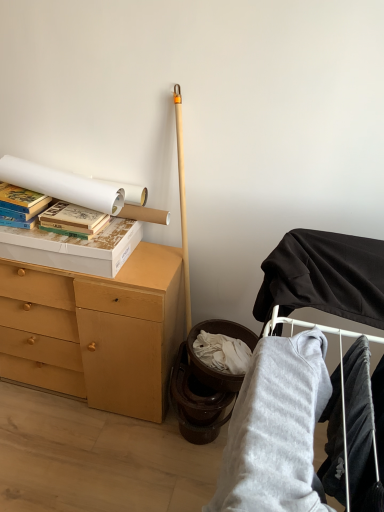
What do you see at coordinates (71, 219) in the screenshot? I see `matte cardboard book at upper left, which is the first paperback book from right to left` at bounding box center [71, 219].

This screenshot has height=512, width=384. What do you see at coordinates (276, 429) in the screenshot?
I see `gray fleece sweatshirt at lower right, the 1th clothing positioned from the left` at bounding box center [276, 429].

You are a GUI agent. You are given a task and a screenshot of the screen. Output one action in this format:
    pyautogui.click(x=<x>, y=<y>)
    Task: Click on the white cardboard box at upper left
    The height and width of the screenshot is (512, 384).
    Given the screenshot: What is the action you would take?
    pyautogui.click(x=74, y=248)

The image size is (384, 512). I want to click on black matte fabric at upper right, so click(x=344, y=421).

This screenshot has height=512, width=384. Identify the location of velvet black pants at lower right, the 2th clothing from the left. (363, 430).

This screenshot has height=512, width=384. In order to click on hardcover books at left, marked as the first paperback book in a left-to-right arrangement in this screenshot , I will do `click(22, 200)`.

Which of these two, black matte fabric at upper right or light brown wood chest of drawers at left, is bigger?

light brown wood chest of drawers at left is bigger.

Looking at this image, which of these two, black matte fabric at upper right or light brown wood chest of drawers at left, is thinner?

With smaller width is light brown wood chest of drawers at left.

Considering the points (342, 379) and (96, 377), which point is behind, point (342, 379) or point (96, 377)?

The point (96, 377) is farther.

Considering the relative sizes of light brown wood chest of drawers at left and white cardboard box at upper left in the image provided, is light brown wood chest of drawers at left wider than white cardboard box at upper left?

Yes.

Is white cardboard box at upper left at the back of light brown wood chest of drawers at left?

No, white cardboard box at upper left is not at the back of light brown wood chest of drawers at left.

From the image's perspective, which one is positioned higher, light brown wood chest of drawers at left or white cardboard box at upper left?

white cardboard box at upper left is shown above in the image.

This screenshot has width=384, height=512. I want to click on the chest of drawers lying below the black matte fabric at upper right (from the image's perspective), so point(96,330).

From the image's perspective, who appears lower, light brown wood chest of drawers at left or black matte fabric at upper right?

light brown wood chest of drawers at left appears lower in the image.

Is light brown wood chest of drawers at left facing away from black matte fabric at upper right?

No, light brown wood chest of drawers at left is not facing away from black matte fabric at upper right.

From the image's perspective, is matte cardboard book at upper left, which is the first paperback book from right to left, positioned above or below gray fleece sweatshirt at lower right, the 1th clothing positioned from the left?

Clearly, from the image's perspective, matte cardboard book at upper left, which is the first paperback book from right to left, is above gray fleece sweatshirt at lower right, the 1th clothing positioned from the left.

Is matte cardboard book at upper left, which is the first paperback book from right to left, not near gray fleece sweatshirt at lower right, positioned as the 2th clothing in right-to-left order?

No, matte cardboard book at upper left, which is the first paperback book from right to left, is in close proximity to gray fleece sweatshirt at lower right, positioned as the 2th clothing in right-to-left order.

From a real-world perspective, which object rests below the other?

gray fleece sweatshirt at lower right, the 1th clothing positioned from the left, from a real-world perspective.

Is gray fleece sweatshirt at lower right, positioned as the 2th clothing in right-to-left order, at the right side of black matte fabric at upper right?

No.

How different are the orientations of gray fleece sweatshirt at lower right, positioned as the 2th clothing in right-to-left order, and black matte fabric at upper right in degrees?

gray fleece sweatshirt at lower right, positioned as the 2th clothing in right-to-left order, and black matte fabric at upper right are facing 0.000905 degrees away from each other.

I want to click on clothing that is under the black matte fabric at upper right (from a real-world perspective), so click(276, 429).

Would you say gray fleece sweatshirt at lower right, the 1th clothing positioned from the left, is inside or outside black matte fabric at upper right?

gray fleece sweatshirt at lower right, the 1th clothing positioned from the left, is not enclosed by black matte fabric at upper right.

Between light brown wood chest of drawers at left and matte cardboard book at upper left, the 2th paperback book viewed from the left, which one appears on the right side from the viewer's perspective?

From the viewer's perspective, matte cardboard book at upper left, the 2th paperback book viewed from the left, appears more on the right side.

Does light brown wood chest of drawers at left have a greater height compared to matte cardboard book at upper left, the 2th paperback book viewed from the left?

Yes, light brown wood chest of drawers at left is taller than matte cardboard book at upper left, the 2th paperback book viewed from the left.

What's the angular difference between light brown wood chest of drawers at left and matte cardboard book at upper left, which is the first paperback book from right to left,'s facing directions?

The angular difference between light brown wood chest of drawers at left and matte cardboard book at upper left, which is the first paperback book from right to left, is 0.304 degrees.

Consider the image. Could you tell me if light brown wood chest of drawers at left is turned towards matte cardboard book at upper left, which is the first paperback book from right to left?

No.

What's the angular difference between gray fleece sweatshirt at lower right, the 1th clothing positioned from the left, and matte cardboard book at upper left, which is the first paperback book from right to left,'s facing directions?

gray fleece sweatshirt at lower right, the 1th clothing positioned from the left, and matte cardboard book at upper left, which is the first paperback book from right to left, are facing 90.9 degrees away from each other.

Considering the relative sizes of gray fleece sweatshirt at lower right, positioned as the 2th clothing in right-to-left order, and matte cardboard book at upper left, which is the first paperback book from right to left, in the image provided, is gray fleece sweatshirt at lower right, positioned as the 2th clothing in right-to-left order, taller than matte cardboard book at upper left, which is the first paperback book from right to left,?

Yes.

Considering the sizes of gray fleece sweatshirt at lower right, positioned as the 2th clothing in right-to-left order, and matte cardboard book at upper left, which is the first paperback book from right to left, in the image, is gray fleece sweatshirt at lower right, positioned as the 2th clothing in right-to-left order, wider or thinner than matte cardboard book at upper left, which is the first paperback book from right to left,?

Clearly, gray fleece sweatshirt at lower right, positioned as the 2th clothing in right-to-left order, has more width compared to matte cardboard book at upper left, which is the first paperback book from right to left.

From a real-world perspective, does gray fleece sweatshirt at lower right, the 1th clothing positioned from the left, stand above matte cardboard book at upper left, the 2th paperback book viewed from the left?

Actually, gray fleece sweatshirt at lower right, the 1th clothing positioned from the left, is physically below matte cardboard book at upper left, the 2th paperback book viewed from the left, in the real world.

I want to click on the chest of drawers that is below the black matte fabric at upper right (from the image's perspective), so click(x=96, y=330).

This screenshot has width=384, height=512. What are the coordinates of `box that is above the light brown wood chest of drawers at left (from the image's perspective)` in the screenshot? It's located at (74, 248).

From the picture: Based on their spatial positions, is light brown wood chest of drawers at left or black matte fabric at upper right closer to gray fleece sweatshirt at lower right, the 1th clothing positioned from the left?

Based on the image, black matte fabric at upper right appears to be nearer to gray fleece sweatshirt at lower right, the 1th clothing positioned from the left.

When comparing their distances from velvet black pants at lower right, the 2th clothing from the left, does white cardboard box at upper left or matte cardboard book at upper left, which is the first paperback book from right to left, seem further?

matte cardboard book at upper left, which is the first paperback book from right to left, is further to velvet black pants at lower right, the 2th clothing from the left.

Consider the image. Based on their spatial positions, is matte cardboard book at upper left, the 2th paperback book viewed from the left, or velvet black pants at lower right, the 2th clothing from the left, closer to black matte fabric at upper right?

The object closer to black matte fabric at upper right is velvet black pants at lower right, the 2th clothing from the left.

When comparing their distances from white cardboard box at upper left, does black matte fabric at upper right or matte cardboard book at upper left, which is the first paperback book from right to left, seem closer?

matte cardboard book at upper left, which is the first paperback book from right to left, lies closer to white cardboard box at upper left than the other object.

Looking at the image, which one is located further to gray fleece sweatshirt at lower right, positioned as the 2th clothing in right-to-left order, velvet black pants at lower right, the 2th clothing from the left, or hardcover books at left, which is counted as the 2th paperback book, starting from the right?

hardcover books at left, which is counted as the 2th paperback book, starting from the right, lies further to gray fleece sweatshirt at lower right, positioned as the 2th clothing in right-to-left order, than the other object.

From the image, which object appears to be nearer to matte cardboard book at upper left, which is the first paperback book from right to left, hardcover books at left, marked as the first paperback book in a left-to-right arrangement, or black matte fabric at upper right?

The object closer to matte cardboard book at upper left, which is the first paperback book from right to left, is hardcover books at left, marked as the first paperback book in a left-to-right arrangement.

From the image, which object appears to be farther from velvet black pants at lower right, the 2th clothing from the left, light brown wood chest of drawers at left or matte cardboard book at upper left, which is the first paperback book from right to left?

matte cardboard book at upper left, which is the first paperback book from right to left, is further to velvet black pants at lower right, the 2th clothing from the left.

When comparing their distances from white cardboard box at upper left, does velvet black pants at lower right, the 2th clothing from the left, or black matte fabric at upper right seem further?

velvet black pants at lower right, the 2th clothing from the left, lies further to white cardboard box at upper left than the other object.

I want to click on clothing located between gray fleece sweatshirt at lower right, the 1th clothing positioned from the left, and black matte fabric at upper right in the depth direction, so click(363, 430).

Identify the location of chest of drawers between gray fleece sweatshirt at lower right, the 1th clothing positioned from the left, and matte cardboard book at upper left, the 2th paperback book viewed from the left, in the front-back direction. (96, 330).

I want to click on clothing between hardcover books at left, marked as the first paperback book in a left-to-right arrangement, and velvet black pants at lower right, positioned as the first clothing in right-to-left order, so click(276, 429).

At what (x,y) coordinates should I click in order to perform the action: click on clothing located between light brown wood chest of drawers at left and velvet black pants at lower right, the 2th clothing from the left, in the left-right direction. Please return your answer as a coordinate pair (x, y). Looking at the image, I should click on (276, 429).